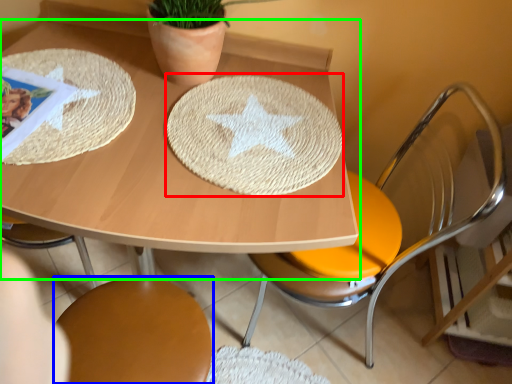
Question: Which is farther away from plate (highlighted by a red box)? chair (highlighted by a blue box) or table (highlighted by a green box)?

Choices:
 (A) chair
 (B) table

Answer: (A)